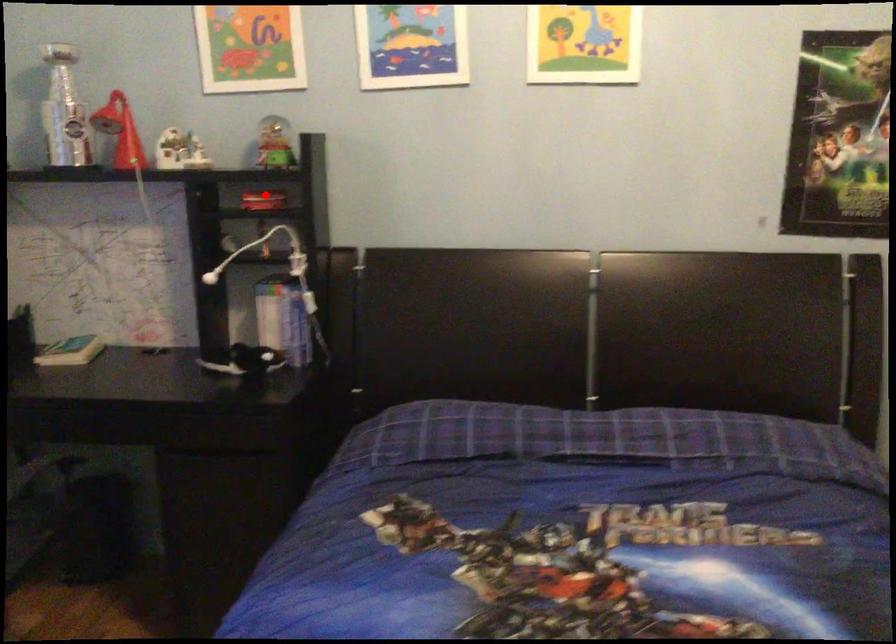
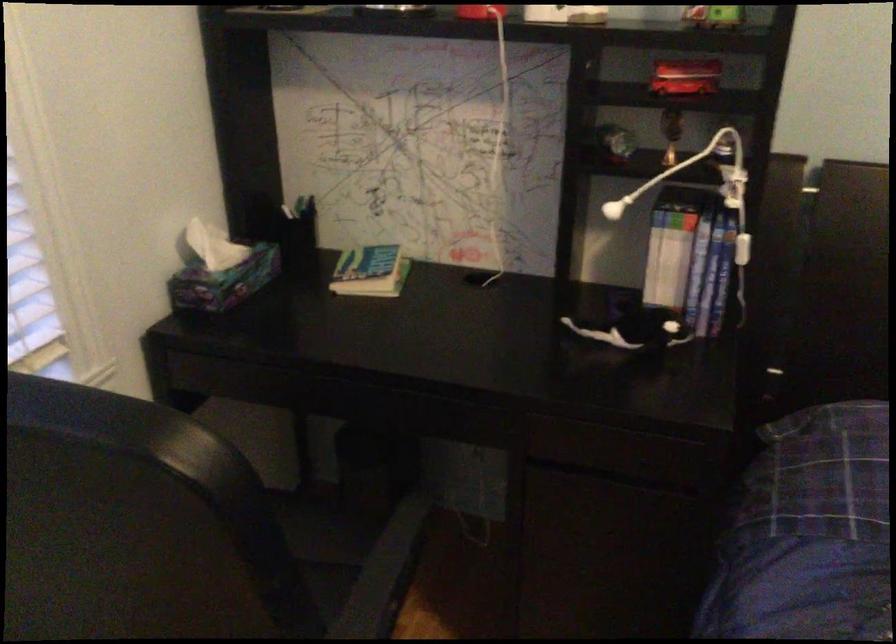
Question: I am providing you with two images of the same scene from different viewpoints. Given a red point in image1, look at the same physical point in image2. Is it:

Choices:
 (A) Closer to the viewpoint
 (B) Farther from the viewpoint

Answer: (A)